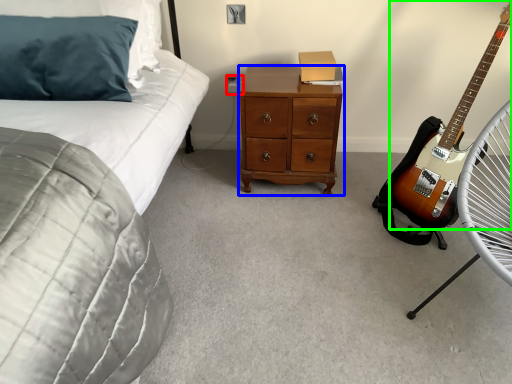
Question: Estimate the real-world distances between objects in this image. Which object is closer to electric outlet (highlighted by a red box), chest of drawers (highlighted by a blue box) or guitar (highlighted by a green box)?

Choices:
 (A) chest of drawers
 (B) guitar

Answer: (A)